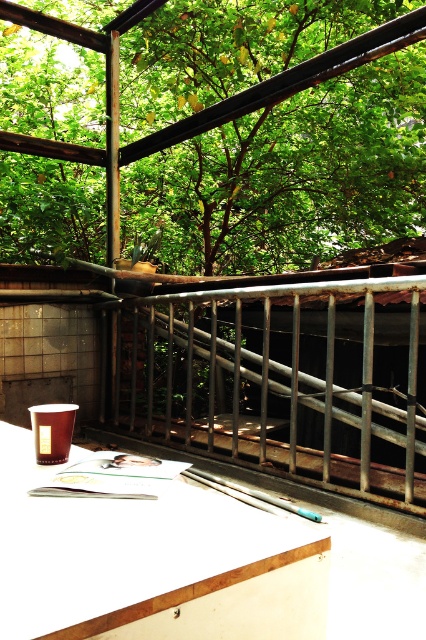
Is point (164, 51) farther from viewer compared to point (261, 552)?

Yes, it is behind point (261, 552).

Is the position of green leafy tree at upper center less distant than that of white glossy ledge at lower center?

No, it is behind white glossy ledge at lower center.

Is point (236, 241) farther from viewer compared to point (245, 545)?

Yes, point (236, 241) is behind point (245, 545).

Identify the location of green leafy tree at upper center. (273, 132).

Is point (170, 499) positioned in front of point (135, 465)?

That is True.

Is white glossy ledge at lower center shorter than metallic silver skateboard at center?

Incorrect, white glossy ledge at lower center's height does not fall short of metallic silver skateboard at center's.

Which is in front, point (143, 548) or point (111, 461)?

Point (143, 548) is in front.

Where is `white glossy ledge at lower center`? This screenshot has height=640, width=426. white glossy ledge at lower center is located at coordinates (x=152, y=563).

Does green leafy tree at upper center have a greater height compared to rusty metal railing at center?

Yes, green leafy tree at upper center is taller than rusty metal railing at center.

How much distance is there between green leafy tree at upper center and rusty metal railing at center?

A distance of 4.82 feet exists between green leafy tree at upper center and rusty metal railing at center.

Is point (94, 35) farther from camera compared to point (273, 451)?

That is True.

You are a GUI agent. You are given a task and a screenshot of the screen. Output one action in this format:
    pyautogui.click(x=<x>, y=<y>)
    Task: Click on the green leafy tree at upper center
    The height and width of the screenshot is (640, 426).
    Given the screenshot: What is the action you would take?
    tap(273, 132)